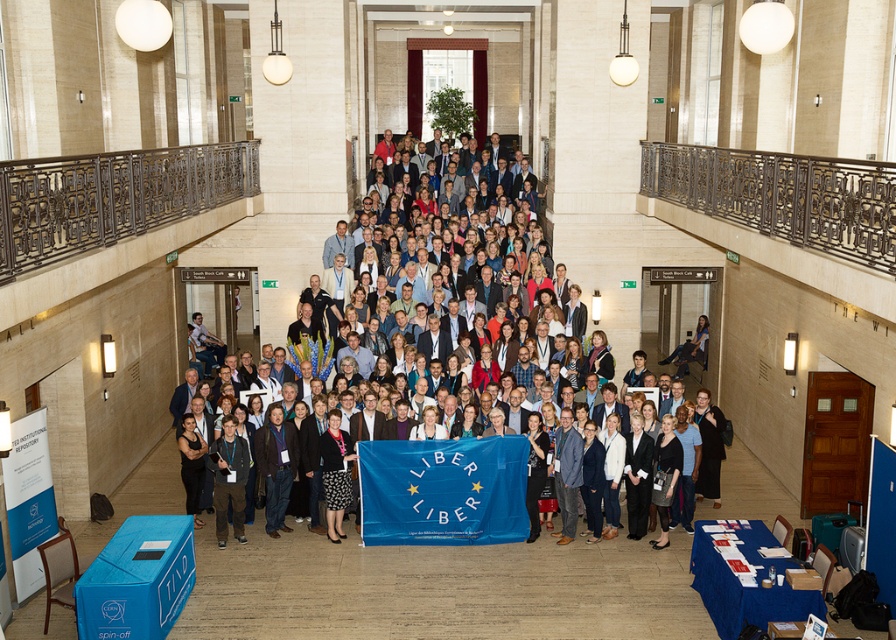
Is blue fabric banner at center wider than blue fabric flag at center?

Correct, the width of blue fabric banner at center exceeds that of blue fabric flag at center.

Is blue fabric banner at center to the right of blue fabric flag at center from the viewer's perspective?

Yes, blue fabric banner at center is to the right of blue fabric flag at center.

You are a GUI agent. You are given a task and a screenshot of the screen. Output one action in this format:
    pyautogui.click(x=<x>, y=<y>)
    Task: Click on the blue fabric banner at center
    
    Given the screenshot: What is the action you would take?
    pyautogui.click(x=610, y=224)